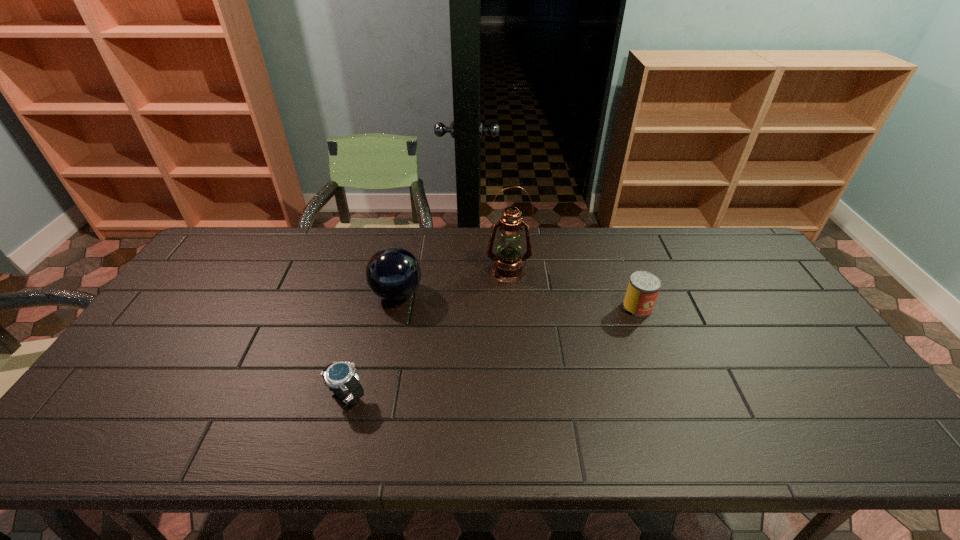
Identify the location of free location at the far edge. (470, 233).

This screenshot has height=540, width=960. I want to click on free space at the near edge, so click(x=578, y=453).

The width and height of the screenshot is (960, 540). In the image, there is a desktop. In order to click on vacant space at the left edge in this screenshot , I will do click(141, 369).

You are a GUI agent. You are given a task and a screenshot of the screen. Output one action in this format:
    pyautogui.click(x=<x>, y=<y>)
    Task: Click on the vacant space at the right edge of the desktop
    
    Given the screenshot: What is the action you would take?
    pyautogui.click(x=799, y=341)

The height and width of the screenshot is (540, 960). Identify the location of vacant region at the far left corner of the desktop. (240, 237).

Find the location of a particular element. Image resolution: width=960 pixels, height=540 pixels. blank space at the far right corner of the desktop is located at coordinates click(x=726, y=255).

Where is `unoccupied area between the third shortest object and the watch`? The height and width of the screenshot is (540, 960). unoccupied area between the third shortest object and the watch is located at coordinates (372, 345).

At what (x,y) coordinates should I click in order to perform the action: click on blank region between the bowling ball and the can. Please return your answer as a coordinate pair (x, y). Image resolution: width=960 pixels, height=540 pixels. Looking at the image, I should click on (517, 301).

Where is `free spot between the can and the third shortest object`? free spot between the can and the third shortest object is located at coordinates (517, 301).

The image size is (960, 540). In order to click on empty location between the third object from left to right and the bowling ball in this screenshot , I will do `click(452, 282)`.